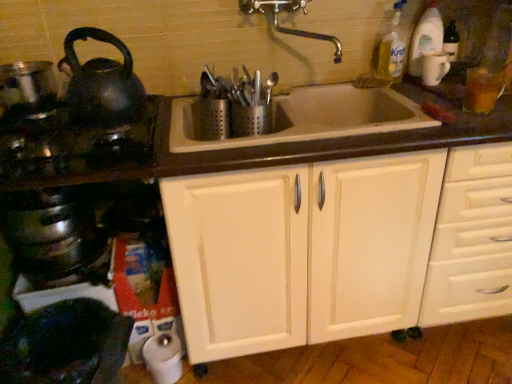
Question: Is white ceramic sink at center bigger or smaller than shiny metallic pot at left?

Choices:
 (A) small
 (B) big

Answer: (B)

Question: Would you say white ceramic sink at center is to the left or to the right of shiny metallic pot at left in the picture?

Choices:
 (A) right
 (B) left

Answer: (A)

Question: Estimate the real-world distances between objects in this image. Which object is farther from the shiny black kettle at left?

Choices:
 (A) shiny black kettle at left
 (B) white wood cabinet at center
 (C) white ceramic sink at center
 (D) shiny metallic pot at left
 (E) shiny metallic crock pot at lower left

Answer: (B)

Question: Which of these objects is positioned farthest from the yellow plastic bottle at upper right, which is the first bottle in left-to-right order?

Choices:
 (A) shiny black kettle at left
 (B) shiny metallic crock pot at lower left
 (C) white glossy mug at upper right
 (D) white ceramic sink at center
 (E) white wood cabinet at center

Answer: (B)